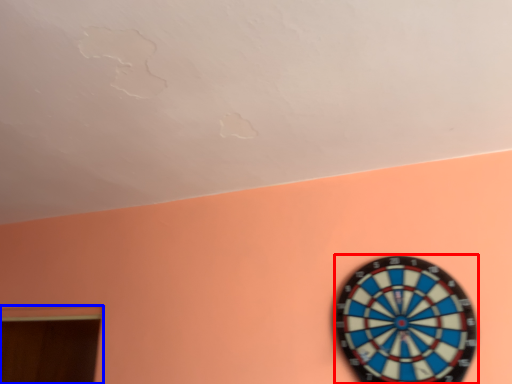
Question: Which object appears farthest to the camera in this image, clock (highlighted by a red box) or window (highlighted by a blue box)?

Choices:
 (A) clock
 (B) window

Answer: (B)